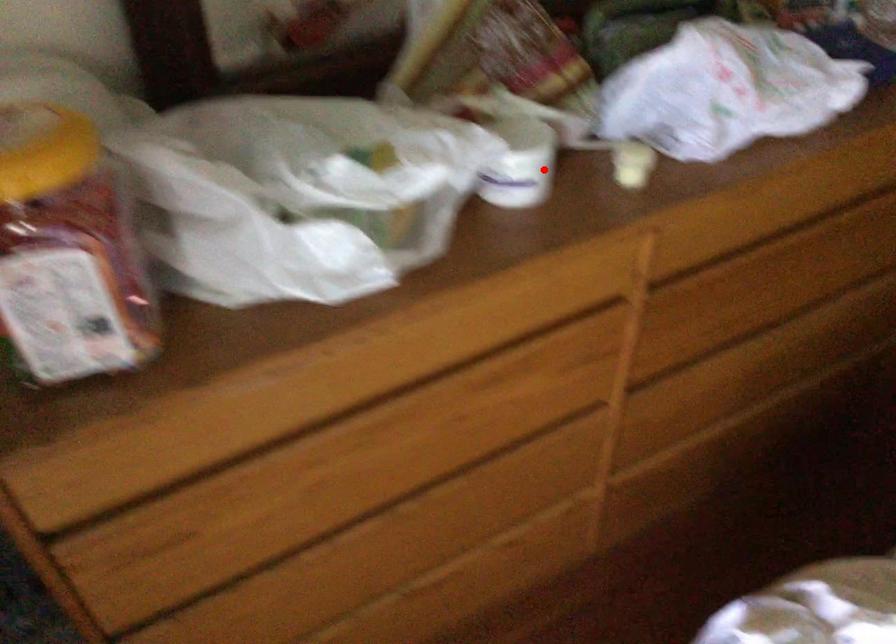
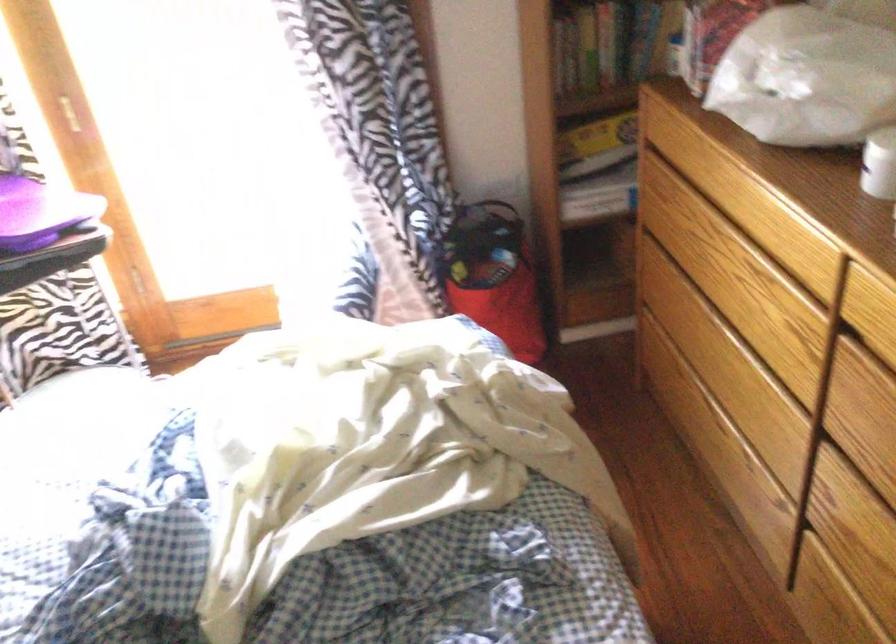
Question: I am providing you with two images of the same scene from different viewpoints. A red point is shown in image1. For the corresponding object point in image2, is it positioned nearer or farther from the camera?

Choices:
 (A) Nearer
 (B) Farther

Answer: (B)